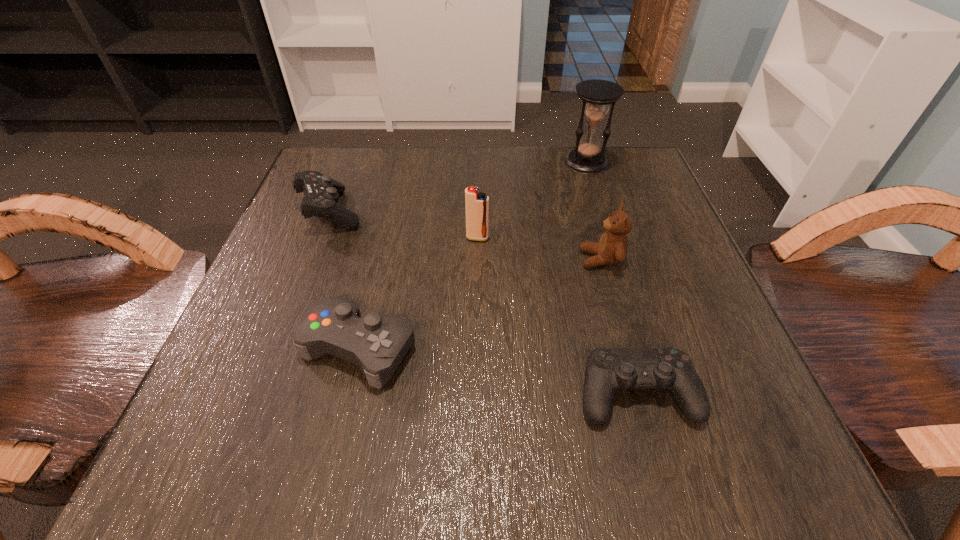
Where is `vacant space that's between the farthest control and the third object from left to right`? vacant space that's between the farthest control and the third object from left to right is located at coordinates (404, 224).

Where is `vacant area that lies between the rightmost control and the fourth object from right to left`? Image resolution: width=960 pixels, height=540 pixels. vacant area that lies between the rightmost control and the fourth object from right to left is located at coordinates (557, 315).

I want to click on object that is the fourth closest one to the farthest control, so click(596, 95).

This screenshot has height=540, width=960. Identify the location of object that is the fifth closest one to the hourglass. (607, 370).

Identify which control is the nearest to the third object from left to right. Please provide its 2D coordinates. Your answer should be formatted as a tuple, i.e. [(x, y)], where the tuple contains the x and y coordinates of a point satisfying the conditions above.

[(376, 343)]

The width and height of the screenshot is (960, 540). I want to click on control that is the third closest one to the teddy bear, so [x=321, y=192].

You are a GUI agent. You are given a task and a screenshot of the screen. Output one action in this format:
    pyautogui.click(x=<x>, y=<y>)
    Task: Click on the vacant space that satisfies the following two spatial constraints: 1. on the back side of the rightmost control; 2. on the left side of the farthest object
    This screenshot has width=960, height=540.
    Given the screenshot: What is the action you would take?
    pyautogui.click(x=574, y=163)